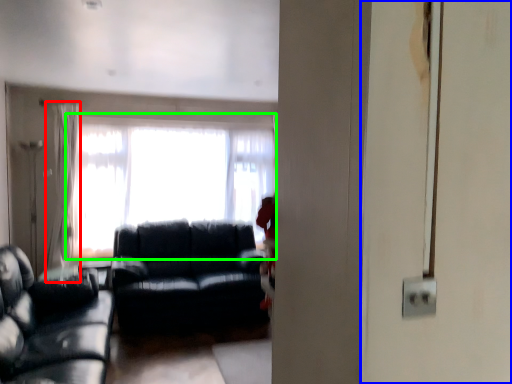
Question: Which is farther away from curtain (highlighted by a red box)? screen door (highlighted by a blue box) or window (highlighted by a green box)?

Choices:
 (A) screen door
 (B) window

Answer: (A)